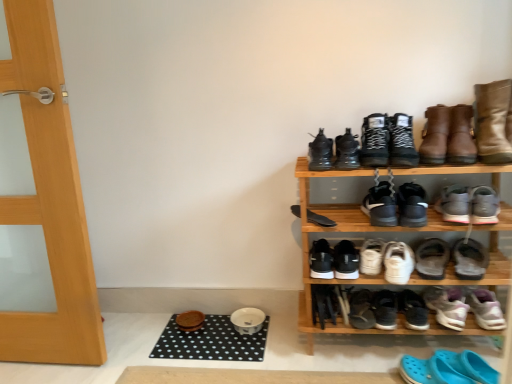
Locate an element on the screen. Image resolution: width=512 pixels, height=384 pixels. free spot below black rubber doormat at lower center, which is the 2th doormat from back to front (from a real-world perspective) is located at coordinates (308, 375).